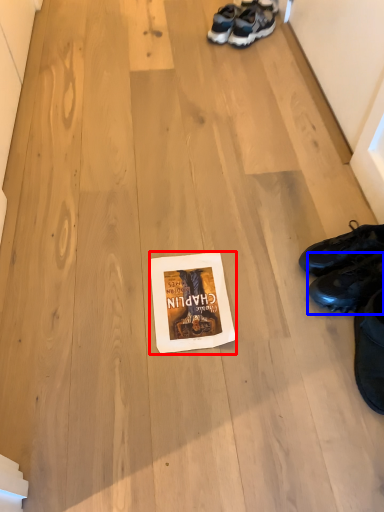
Question: Which object appears closest to the camera in this image, paperback book (highlighted by a red box) or footwear (highlighted by a blue box)?

Choices:
 (A) paperback book
 (B) footwear

Answer: (B)